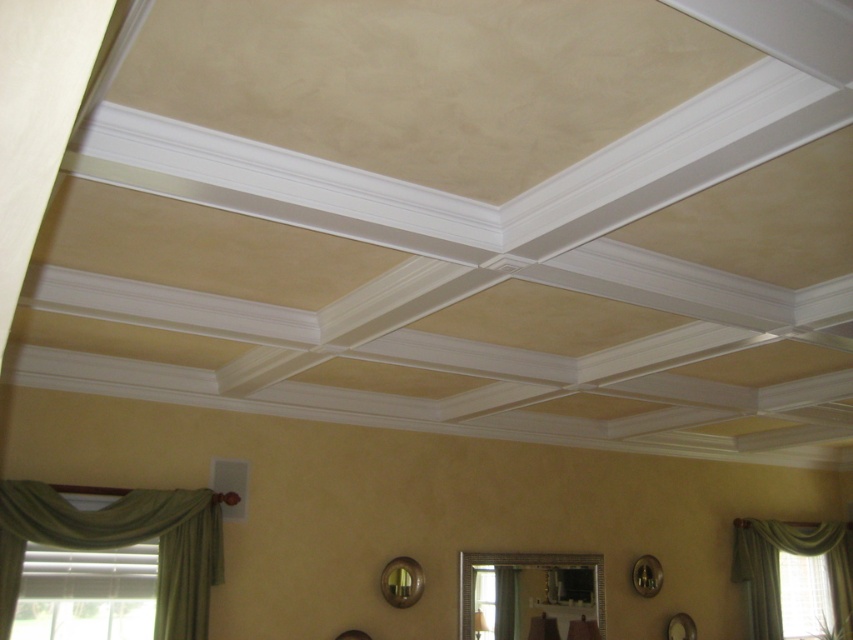
You are an interior designer planning to install a new lighting fixture in the room. You notice the green fabric curtain at lower left and the green fabric curtain at lower right. Which curtain has a larger size that might require more space when positioning the fixture?

The green fabric curtain at lower right has a larger size compared to the green fabric curtain at lower left, so it might require more space when positioning the fixture.

You are standing in the room and want to adjust the green fabric curtains. Which curtain should you reach up higher to adjust, the green fabric curtain at lower left or the green fabric curtain at lower right?

The green fabric curtain at lower left should be reached up higher to adjust since it is positioned above the green fabric curtain at lower right.